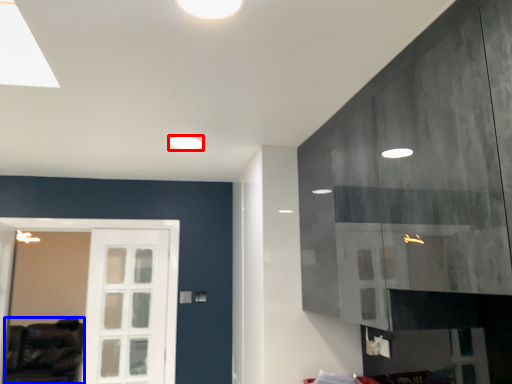
Question: Among these objects, which one is nearest to the camera, lighting (highlighted by a red box) or furniture (highlighted by a blue box)?

Choices:
 (A) lighting
 (B) furniture

Answer: (A)